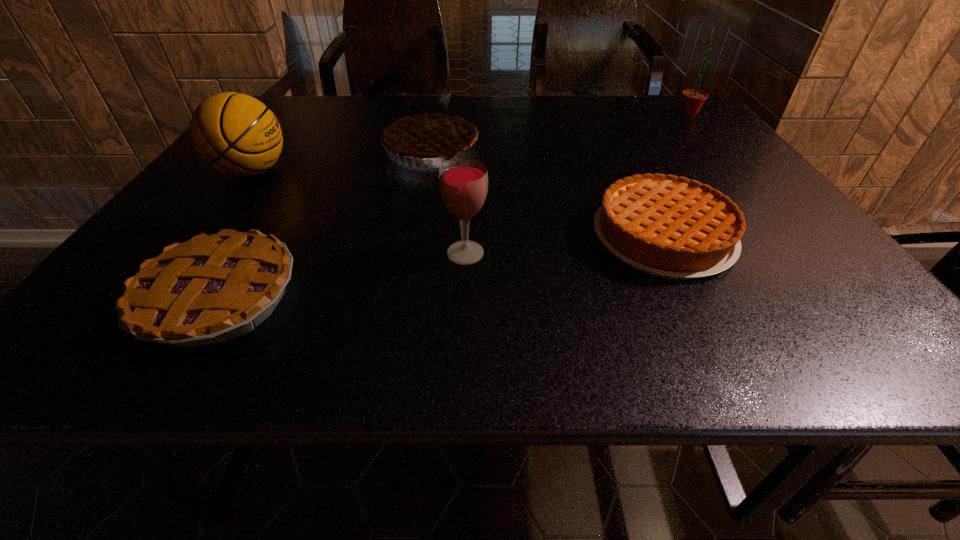
Find the location of a particular element. the farthest object is located at coordinates (692, 100).

You are a GUI agent. You are given a task and a screenshot of the screen. Output one action in this format:
    pyautogui.click(x=<x>, y=<y>)
    Task: Click on the sunflower
    This screenshot has height=540, width=960.
    Given the screenshot: What is the action you would take?
    pyautogui.click(x=692, y=100)

You are a GUI agent. You are given a task and a screenshot of the screen. Output one action in this format:
    pyautogui.click(x=<x>, y=<y>)
    Task: Click on the tallest pie
    This screenshot has width=960, height=540.
    Given the screenshot: What is the action you would take?
    pyautogui.click(x=431, y=131)

Locate an element on the screen. the second pie from right to left is located at coordinates (431, 131).

This screenshot has width=960, height=540. In order to click on basketball in this screenshot , I will do `click(236, 134)`.

Where is `wineglass`? The image size is (960, 540). wineglass is located at coordinates (463, 183).

Locate an element on the screen. The height and width of the screenshot is (540, 960). the fifth object from left to right is located at coordinates (668, 226).

At what (x,y) coordinates should I click in order to perform the action: click on the leftmost pie. Please return your answer as a coordinate pair (x, y). The width and height of the screenshot is (960, 540). Looking at the image, I should click on (213, 288).

Where is `vacant space located 0.050m on the face of the sunflower`? This screenshot has width=960, height=540. vacant space located 0.050m on the face of the sunflower is located at coordinates (660, 114).

Where is `vacant region located on the face of the sunflower`? vacant region located on the face of the sunflower is located at coordinates (563, 114).